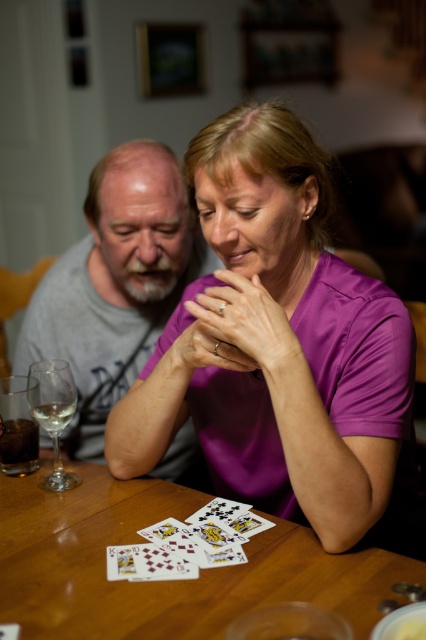
Does purple satin shirt at center have a greater width compared to cardboard playing cards at center?

Yes.

From the picture: Who is positioned more to the left, purple satin shirt at center or cardboard playing cards at center?

cardboard playing cards at center is more to the left.

You are a GUI agent. You are given a task and a screenshot of the screen. Output one action in this format:
    pyautogui.click(x=<x>, y=<y>)
    Task: Click on the purple satin shirt at center
    
    Given the screenshot: What is the action you would take?
    pyautogui.click(x=276, y=342)

This screenshot has width=426, height=640. What do you see at coordinates (276, 342) in the screenshot? I see `purple satin shirt at center` at bounding box center [276, 342].

Is purple satin shirt at center above gray cotton shirt at left?

Incorrect, purple satin shirt at center is not positioned above gray cotton shirt at left.

Who is more forward, (x=313, y=250) or (x=85, y=298)?

Point (x=313, y=250) is in front.

Locate an element on the screen. This screenshot has height=640, width=426. purple satin shirt at center is located at coordinates (276, 342).

Which of these two, wooden table at center or cardboard playing cards at center, stands taller?

wooden table at center

Does point (54, 557) come in front of point (218, 516)?

Yes, it is in front of point (218, 516).

Is point (23, 634) positioned before point (232, 516)?

Yes, point (23, 634) is in front of point (232, 516).

This screenshot has height=640, width=426. I want to click on wooden table at center, so click(x=164, y=580).